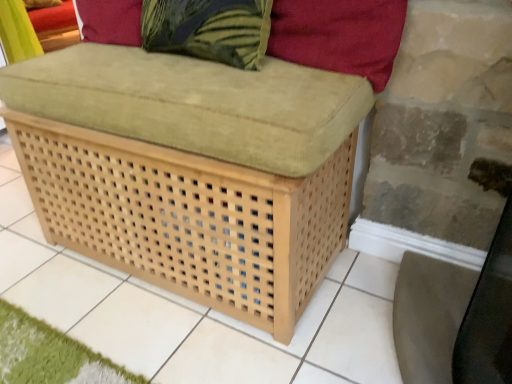
This screenshot has height=384, width=512. What are the coordinates of `free space in front of light brown woven ottoman at center` in the screenshot? It's located at (162, 337).